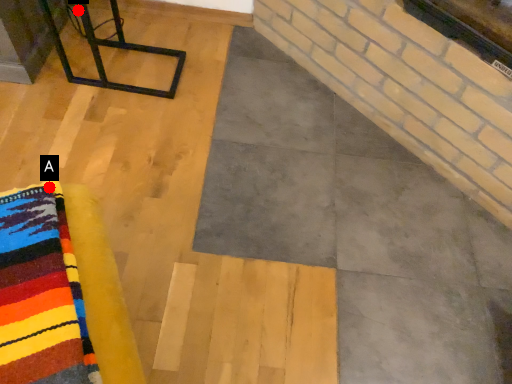
Question: Two points are circled on the image, labeled by A and B beside each circle. Which point appears closest to the camera in this image?

Choices:
 (A) A is closer
 (B) B is closer

Answer: (A)